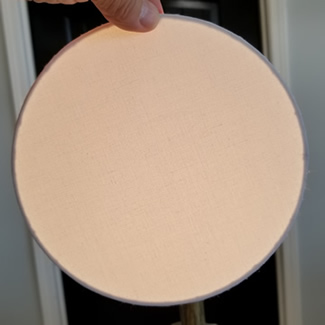
At what (x,y) coordinates should I click in order to perform the action: click on white molding. Please return your answer as a coordinate pair (x, y). The image size is (325, 325). Looking at the image, I should click on (42, 272), (287, 257), (9, 23), (273, 5).